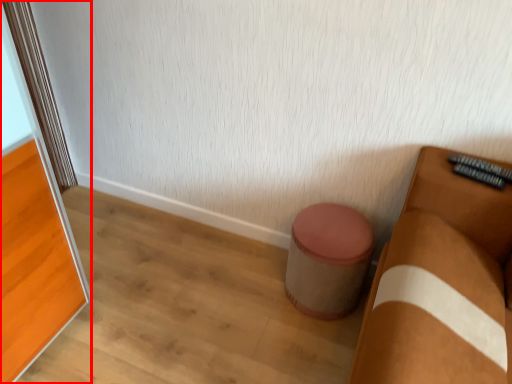
Question: From the image's perspective, what is the correct spatial relationship of screen door (annotated by the red box) in relation to stool?

Choices:
 (A) above
 (B) below

Answer: (A)